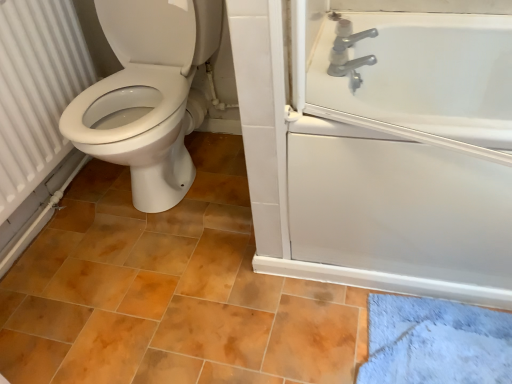
What do you see at coordinates (346, 50) in the screenshot? I see `silver metallic faucet at upper right` at bounding box center [346, 50].

The width and height of the screenshot is (512, 384). What do you see at coordinates (409, 158) in the screenshot?
I see `white glossy bathtub at upper right` at bounding box center [409, 158].

Locate an element on the screen. white textured radiator at left is located at coordinates (36, 91).

Describe the element at coordinates (36, 91) in the screenshot. I see `white textured radiator at left` at that location.

The height and width of the screenshot is (384, 512). Find the location of `silver metallic faucet at upper right`. silver metallic faucet at upper right is located at coordinates (346, 50).

Considering the relative sizes of white textured radiator at left and silver metallic faucet at upper right in the image provided, is white textured radiator at left shorter than silver metallic faucet at upper right?

In fact, white textured radiator at left may be taller than silver metallic faucet at upper right.

From a real-world perspective, who is located lower, white textured radiator at left or silver metallic faucet at upper right?

white textured radiator at left, from a real-world perspective.

The height and width of the screenshot is (384, 512). In order to click on radiator beneath the silver metallic faucet at upper right (from a real-world perspective) in this screenshot , I will do click(x=36, y=91).

Which object is thinner, white textured radiator at left or silver metallic faucet at upper right?

Thinner between the two is white textured radiator at left.

Can you tell me how much silver metallic faucet at upper right and white textured radiator at left differ in facing direction?

The angular difference between silver metallic faucet at upper right and white textured radiator at left is 0.398 degrees.

Is silver metallic faucet at upper right taller or shorter than white textured radiator at left?

Clearly, silver metallic faucet at upper right is shorter compared to white textured radiator at left.

Is silver metallic faucet at upper right beside white textured radiator at left?

No.

Considering the relative positions of white textured radiator at left and white glossy bathtub at upper right in the image provided, is white textured radiator at left to the right of white glossy bathtub at upper right from the viewer's perspective?

No.

Considering the points (16, 122) and (484, 183), which point is behind, point (16, 122) or point (484, 183)?

The point (16, 122) is farther from the camera.

Is white textured radiator at left aimed at white glossy bathtub at upper right?

Yes, white textured radiator at left is turned towards white glossy bathtub at upper right.

Looking at their sizes, would you say white textured radiator at left is wider or thinner than white glossy bathtub at upper right?

white textured radiator at left is thinner than white glossy bathtub at upper right.

Is silver metallic faucet at upper right not inside white glossy bathtub at upper right?

Indeed, silver metallic faucet at upper right is completely outside white glossy bathtub at upper right.

From a real-world perspective, is silver metallic faucet at upper right above or below white glossy bathtub at upper right?

In terms of real-world spatial position, silver metallic faucet at upper right is above white glossy bathtub at upper right.

Which is more distant, (342, 22) or (382, 220)?

The point (342, 22) is behind.

Is silver metallic faucet at upper right shorter than white glossy bathtub at upper right?

Indeed, silver metallic faucet at upper right has a lesser height compared to white glossy bathtub at upper right.

Is point (440, 169) more distant than point (341, 71)?

No, (440, 169) is closer to viewer.

Can you confirm if white glossy bathtub at upper right is smaller than silver metallic faucet at upper right?

Actually, white glossy bathtub at upper right might be larger than silver metallic faucet at upper right.

In terms of width, does white glossy bathtub at upper right look wider or thinner when compared to silver metallic faucet at upper right?

white glossy bathtub at upper right is wider than silver metallic faucet at upper right.

Find the location of a particular element. The width and height of the screenshot is (512, 384). bath that is on the right side of white textured radiator at left is located at coordinates (409, 158).

Which of these two, white glossy bathtub at upper right or white textured radiator at left, is bigger?

white glossy bathtub at upper right.

Can you confirm if white glossy bathtub at upper right is thinner than white textured radiator at left?

No, white glossy bathtub at upper right is not thinner than white textured radiator at left.

How many degrees apart are the facing directions of white glossy bathtub at upper right and white textured radiator at left?

90.7 degrees separate the facing orientations of white glossy bathtub at upper right and white textured radiator at left.

Identify the location of tap behind the white textured radiator at left. This screenshot has width=512, height=384. (346, 50).

You are a GUI agent. You are given a task and a screenshot of the screen. Output one action in this format:
    pyautogui.click(x=<x>, y=<y>)
    Task: Click on the radiator in front of the silver metallic faucet at upper right
    This screenshot has width=512, height=384.
    Given the screenshot: What is the action you would take?
    pyautogui.click(x=36, y=91)

Based on their spatial positions, is silver metallic faucet at upper right or white textured radiator at left closer to white glossy bathtub at upper right?

Among the two, silver metallic faucet at upper right is located nearer to white glossy bathtub at upper right.

Based on the photo, considering their positions, is silver metallic faucet at upper right positioned closer to white textured radiator at left than white glossy bathtub at upper right?

Based on the image, silver metallic faucet at upper right appears to be nearer to white textured radiator at left.

Which object lies nearer to the anchor point white glossy bathtub at upper right, white textured radiator at left or silver metallic faucet at upper right?

Among the two, silver metallic faucet at upper right is located nearer to white glossy bathtub at upper right.

Which object lies further to the anchor point silver metallic faucet at upper right, white textured radiator at left or white glossy bathtub at upper right?

Based on the image, white textured radiator at left appears to be further to silver metallic faucet at upper right.

Estimate the real-world distances between objects in this image. Which object is further from silver metallic faucet at upper right, white glossy bathtub at upper right or white textured radiator at left?

The object further to silver metallic faucet at upper right is white textured radiator at left.

Looking at the image, which one is located further to white textured radiator at left, white glossy bathtub at upper right or silver metallic faucet at upper right?

white glossy bathtub at upper right.

Find the location of a particular element. The image size is (512, 384). tap between white textured radiator at left and white glossy bathtub at upper right in the horizontal direction is located at coordinates (346, 50).